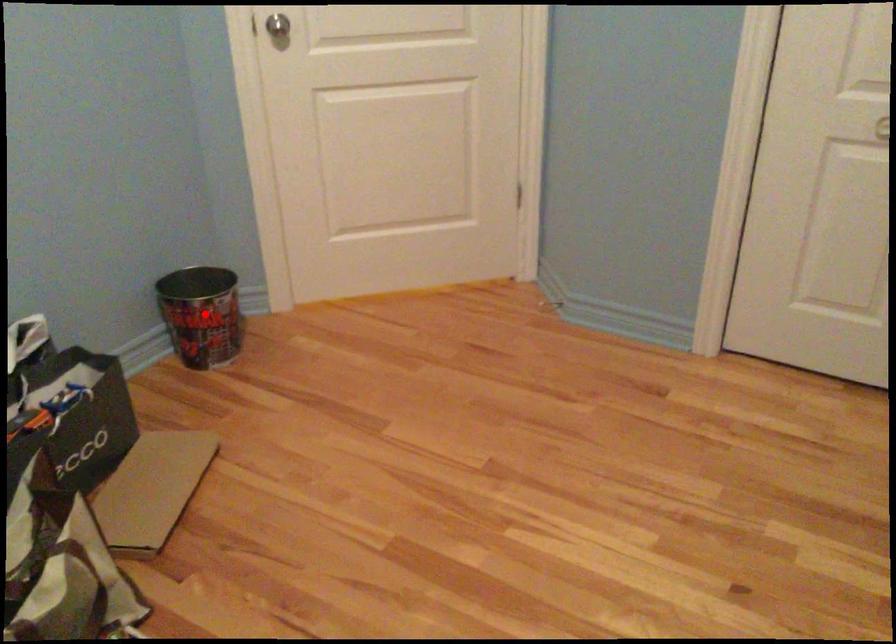
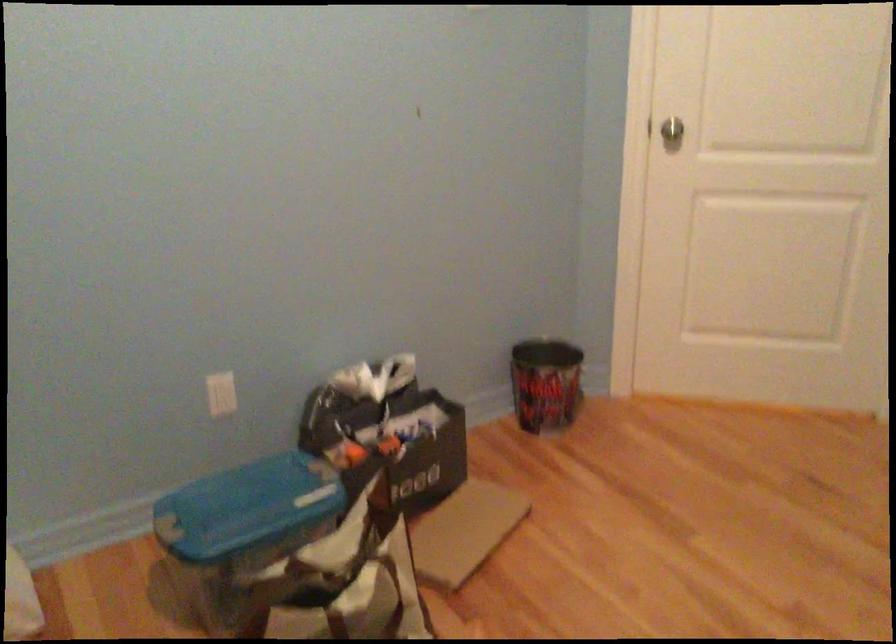
Question: I am providing you with two images of the same scene from different viewpoints. A red point is marked on the first image. Is the red point's position out of view in image 2?

Choices:
 (A) Yes
 (B) No

Answer: (B)